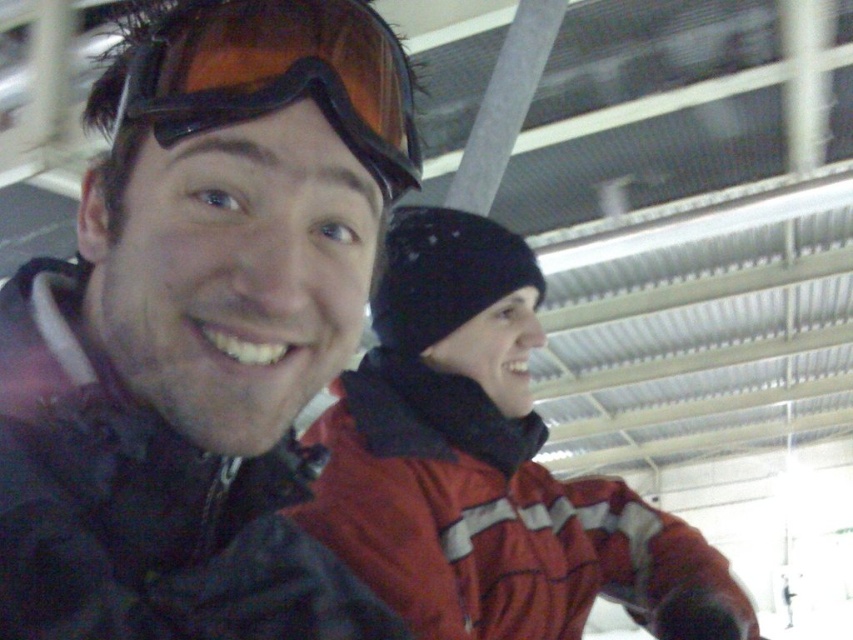
Can you confirm if matte black jacket at left is positioned to the right of red fabric jacket at center?

Incorrect, matte black jacket at left is not on the right side of red fabric jacket at center.

Is point (218, 243) less distant than point (434, 604)?

Yes, it is.

The image size is (853, 640). Identify the location of matte black jacket at left. (200, 332).

Is point (517, 614) positioned in front of point (402, 170)?

No, (517, 614) is further to viewer.

Based on the photo, does red fabric jacket at center have a lesser width compared to matte orange ski goggles at upper left?

No.

You are a GUI agent. You are given a task and a screenshot of the screen. Output one action in this format:
    pyautogui.click(x=<x>, y=<y>)
    Task: Click on the red fabric jacket at center
    The width and height of the screenshot is (853, 640).
    Given the screenshot: What is the action you would take?
    pyautogui.click(x=479, y=460)

What do you see at coordinates (200, 332) in the screenshot?
I see `matte black jacket at left` at bounding box center [200, 332].

Is matte black jacket at left above matte orange ski goggles at upper left?

No, matte black jacket at left is not above matte orange ski goggles at upper left.

Does point (172, 484) come farther from viewer compared to point (395, 186)?

That is True.

Locate an element on the screen. The width and height of the screenshot is (853, 640). matte black jacket at left is located at coordinates (200, 332).